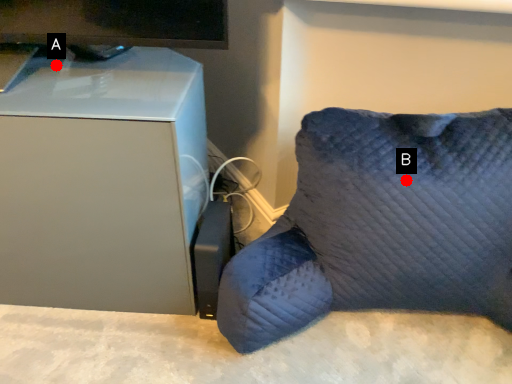
Question: Two points are circled on the image, labeled by A and B beside each circle. Among these points, which one is farthest from the camera?

Choices:
 (A) A is further
 (B) B is further

Answer: (A)